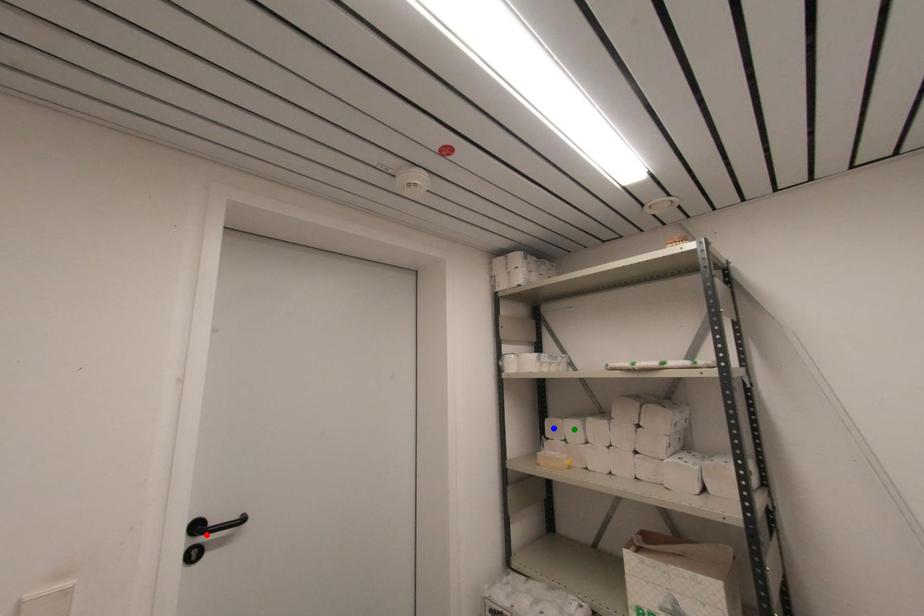
Order these from nearest to farthest:
red point, green point, blue point

blue point, green point, red point